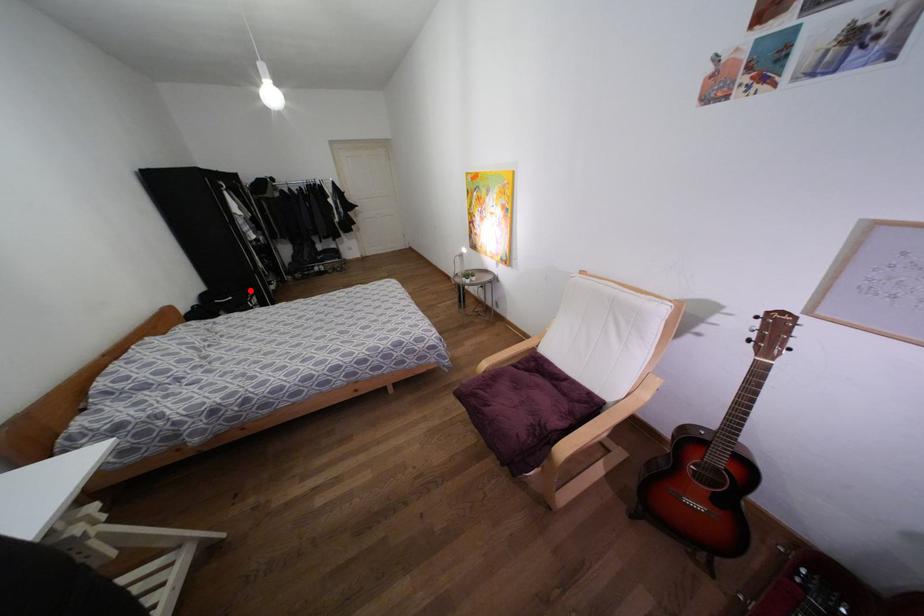
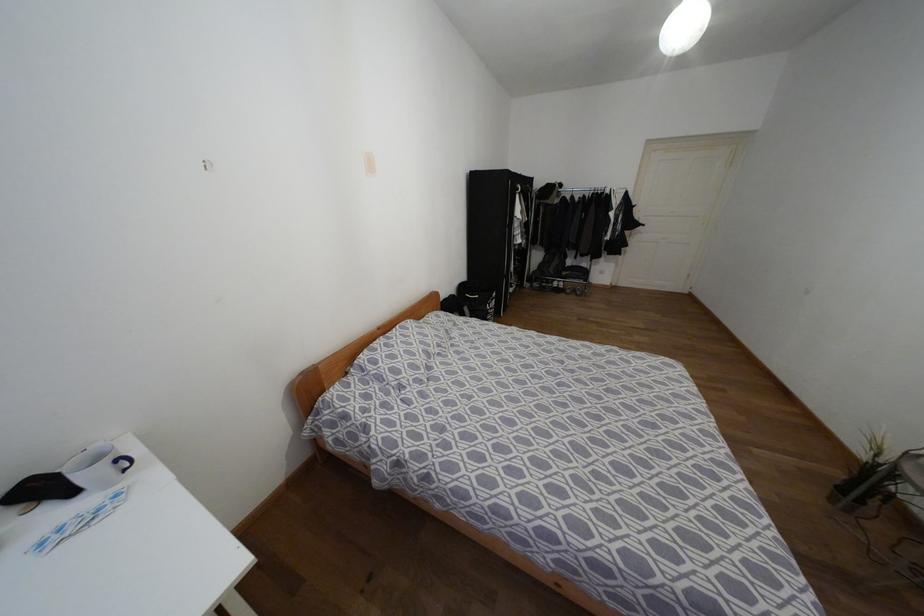
Where in the second image is the point corresponding to the highlighted location from the first image?

(493, 294)